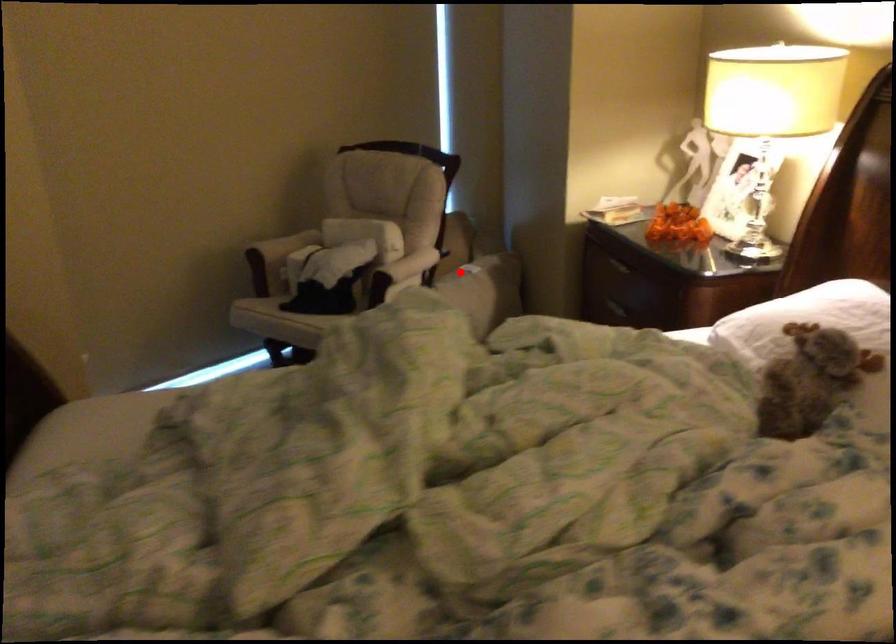
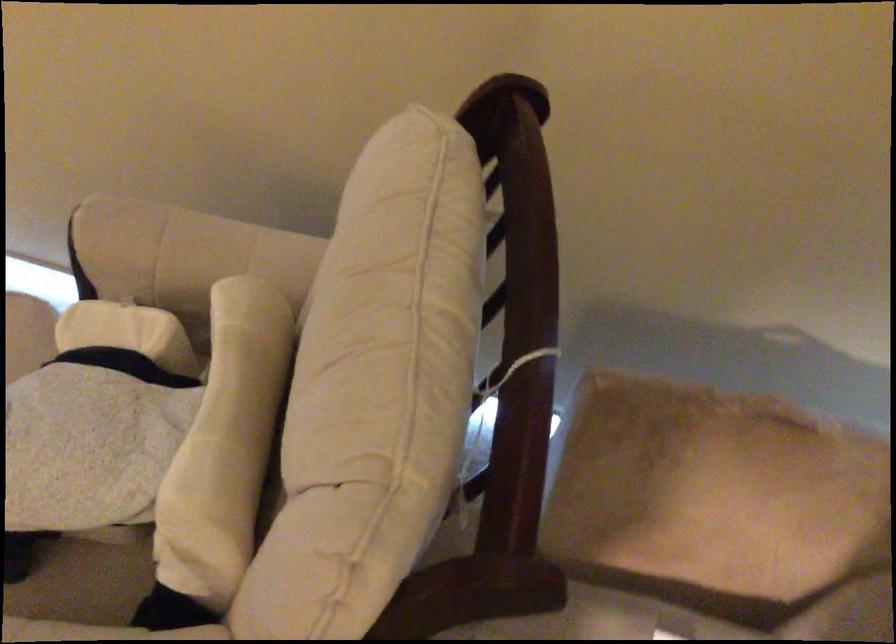
Question: I am providing you with two images of the same scene from different viewpoints. Image1 has a red point marked. In image2, the corresponding 3D location appears at what relative position? Reply with the corresponding letter.

Choices:
 (A) Closer
 (B) Farther

Answer: (A)